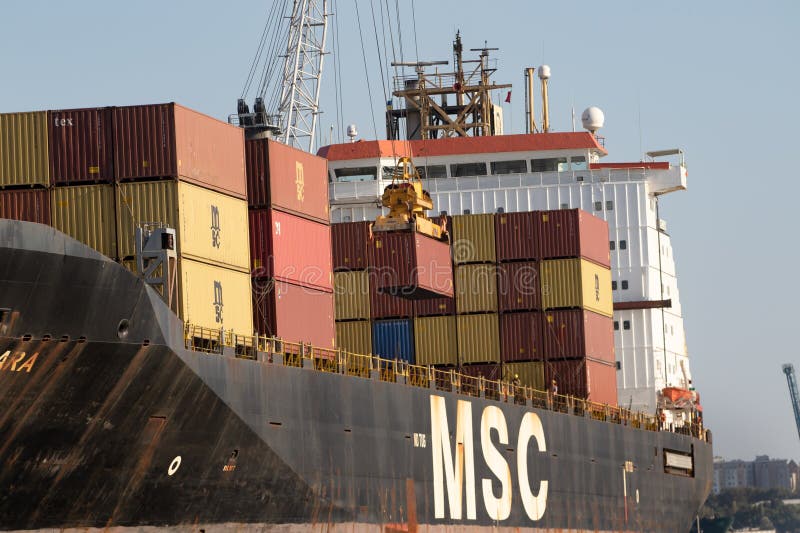
Where is `windows in the ship's bridge`? windows in the ship's bridge is located at coordinates (326, 176), (350, 169), (393, 169), (434, 171), (474, 169), (510, 164), (546, 165), (581, 165), (562, 168).